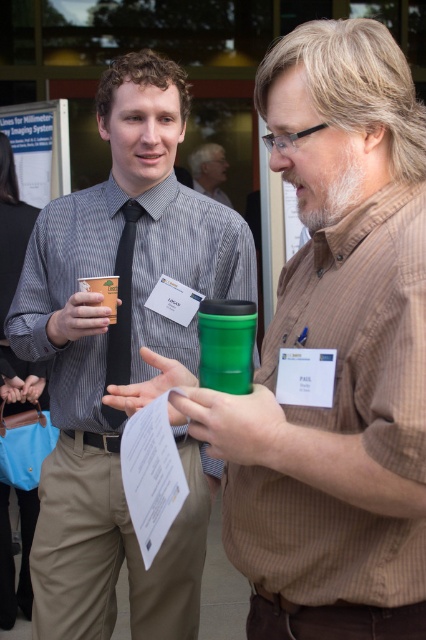
Does point (293, 474) come closer to viewer compared to point (97, 291)?

Yes, point (293, 474) is closer to viewer.

Who is positioned more to the left, green matte cup at left or matte plastic cup at center?

matte plastic cup at center

Does point (261, 109) come farther from viewer compared to point (77, 282)?

No, (261, 109) is in front of (77, 282).

Image resolution: width=426 pixels, height=640 pixels. I want to click on green matte cup at left, so click(x=334, y=355).

Is green matte cup at left to the left of green plastic cup at center from the viewer's perspective?

No, green matte cup at left is not to the left of green plastic cup at center.

Between green matte cup at left and green plastic cup at center, which one has more height?

Standing taller between the two is green matte cup at left.

Who is more forward, (354, 365) or (236, 349)?

Positioned in front is point (354, 365).

Identify the location of green matte cup at left. The image size is (426, 640). pyautogui.click(x=334, y=355).

Can you confirm if green plastic cup at center is wider than matte black tie at center?

In fact, green plastic cup at center might be narrower than matte black tie at center.

Between green plastic cup at center and matte black tie at center, which one is positioned lower?

green plastic cup at center is lower down.

The image size is (426, 640). What are the coordinates of `green plastic cup at center` in the screenshot? It's located at (227, 344).

The image size is (426, 640). I want to click on green plastic cup at center, so click(x=227, y=344).